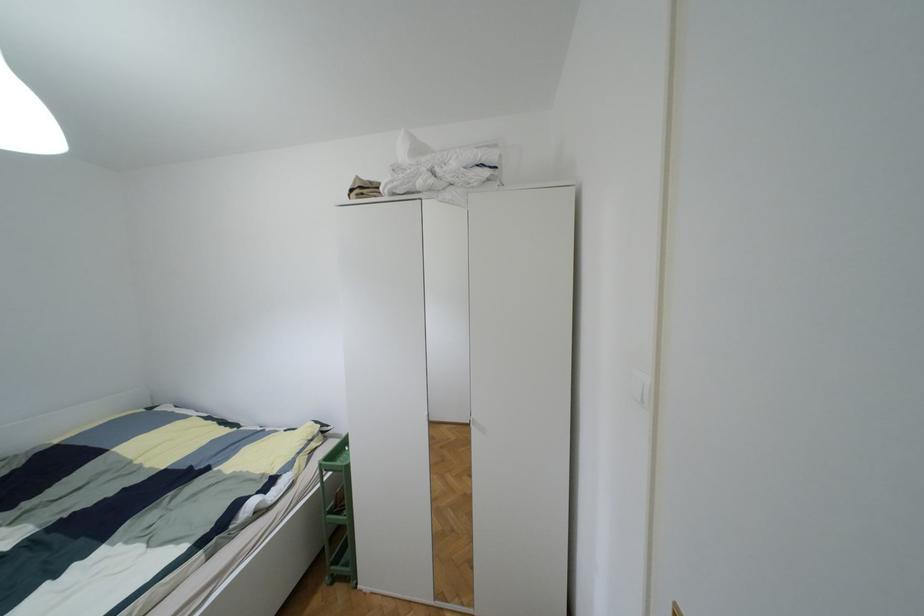
What do you see at coordinates (638, 392) in the screenshot? The width and height of the screenshot is (924, 616). I see `a white light switch` at bounding box center [638, 392].